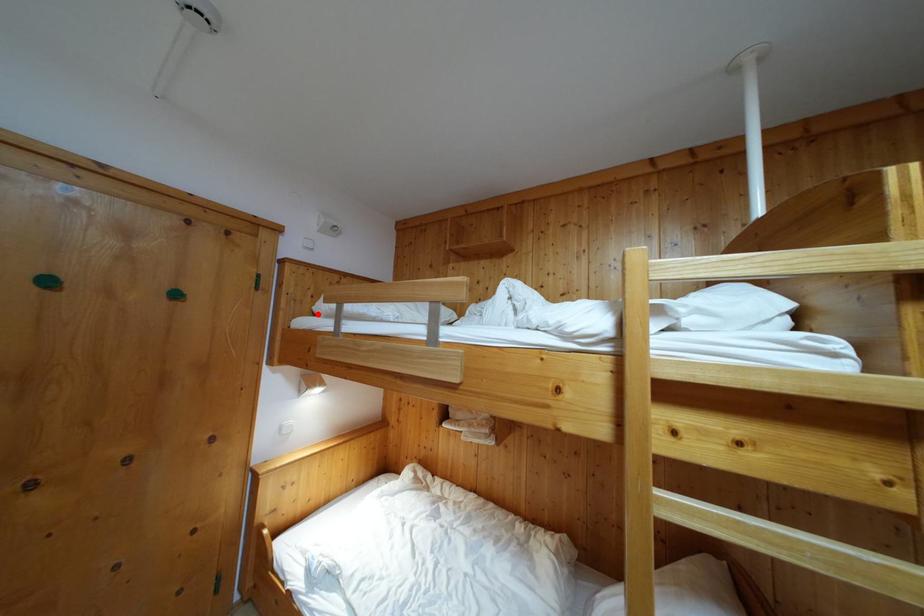
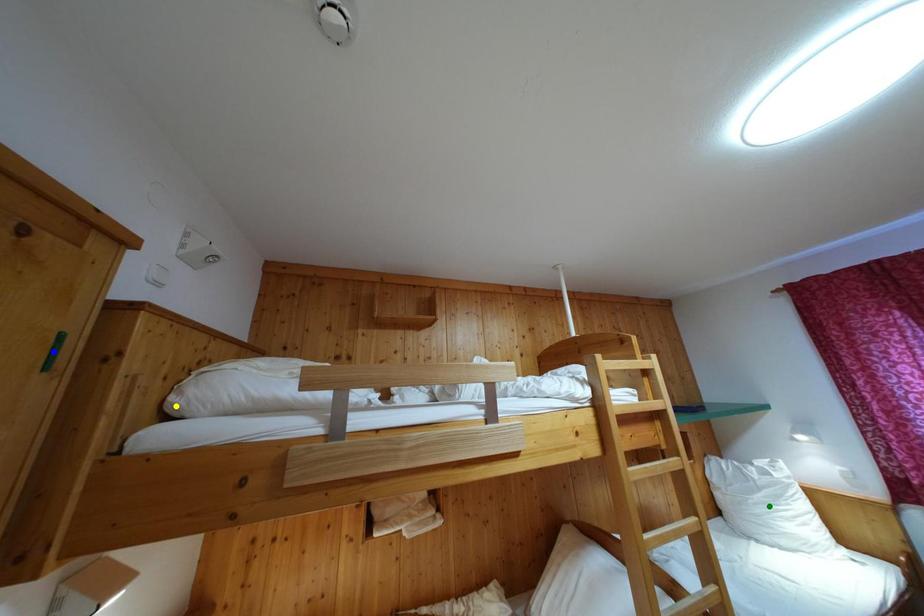
Question: I am providing you with two images of the same scene from different viewpoints. A red point is marked on the first image. You are given multiple points on the second image. Which mark in image 2 goes with the point in image 1?

Choices:
 (A) blue point
 (B) yellow point
 (C) green point

Answer: (B)